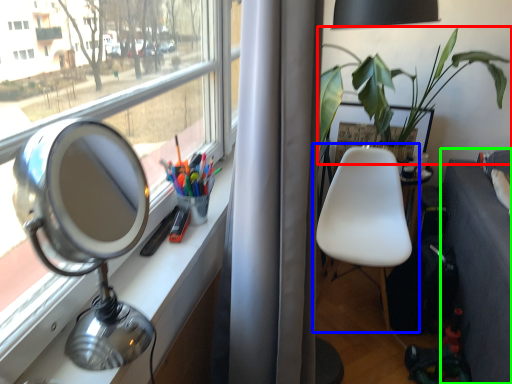
Question: Estimate the real-world distances between objects in this image. Which object is farther from houseplant (highlighted by a red box), chair (highlighted by a blue box) or studio couch (highlighted by a green box)?

Choices:
 (A) chair
 (B) studio couch

Answer: (B)